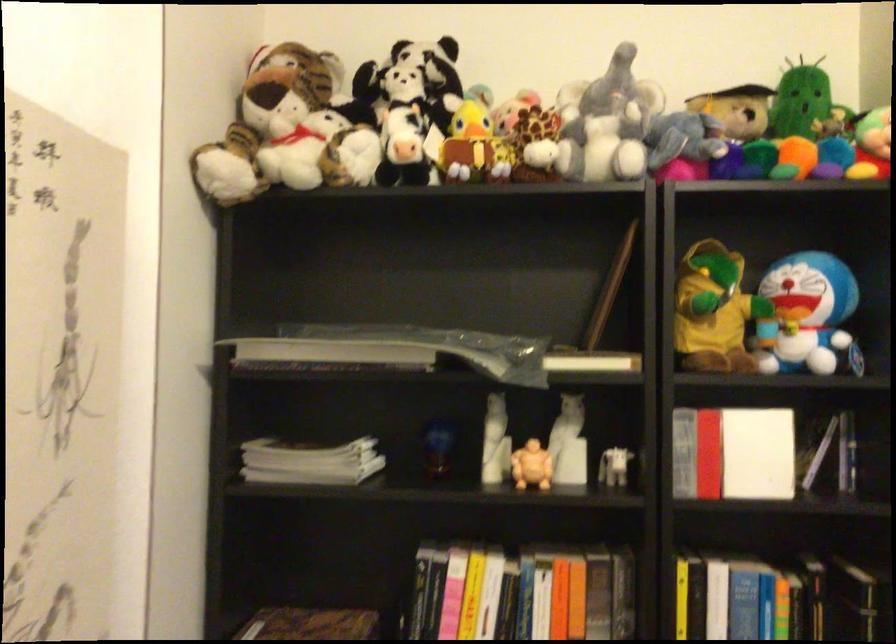
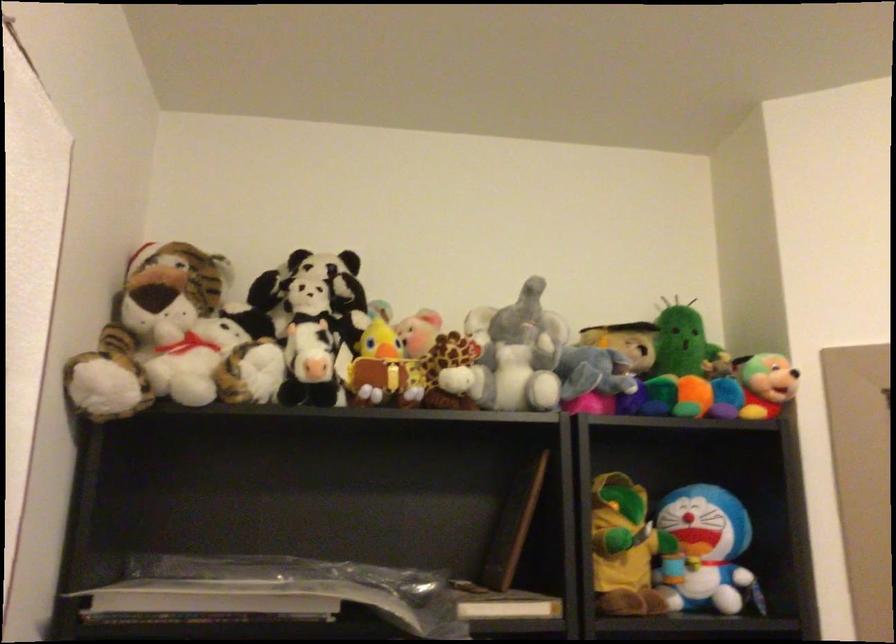
Question: The camera is either moving clockwise (left) or counter-clockwise (right) around the object. The first image is from the beginning of the video and the second image is from the end. Is the camera moving left or right when shooting the video?

Choices:
 (A) Left
 (B) Right

Answer: (A)